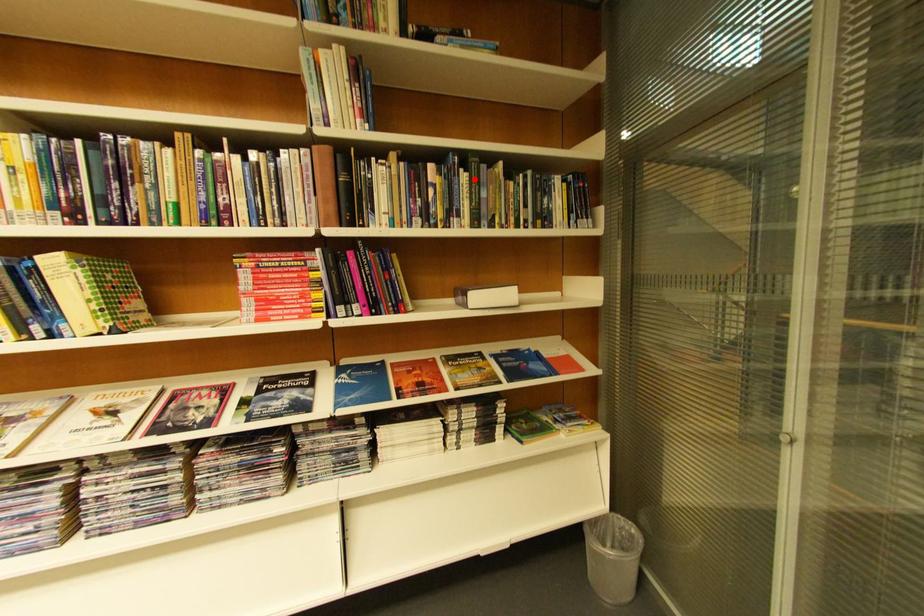
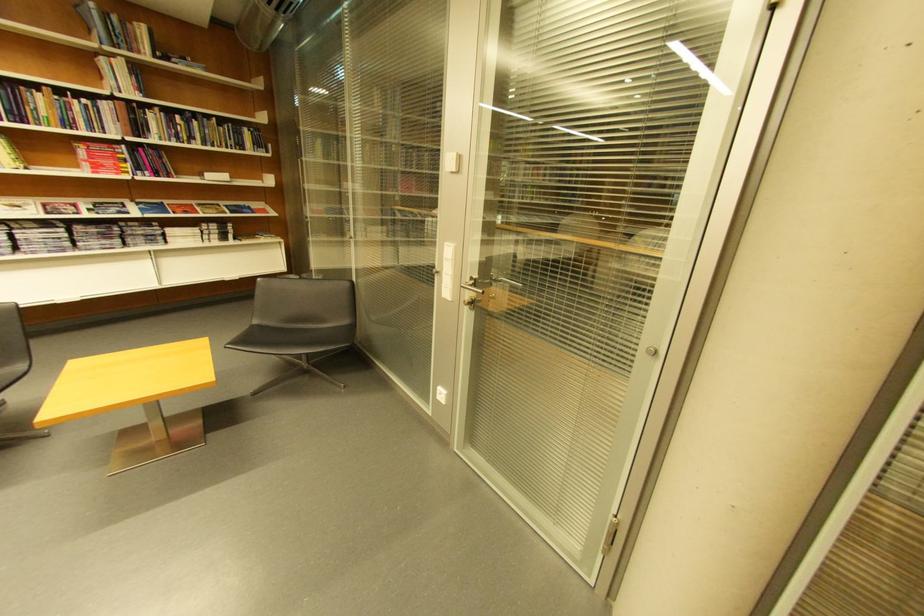
Locate, in the second image, the point that corresponds to the highlighted location in the first image.

(205, 124)